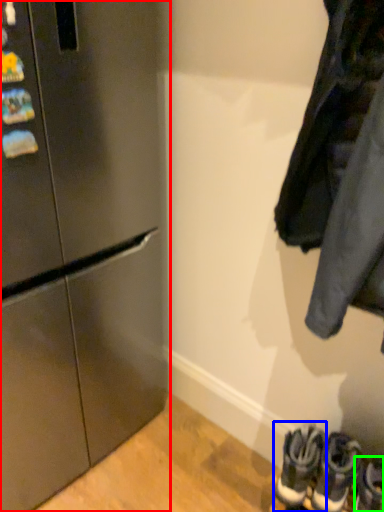
Question: Which object is positioned closest to refrigerator (highlighted by a red box)? Select from footwear (highlighted by a blue box) and footwear (highlighted by a green box).

Choices:
 (A) footwear
 (B) footwear

Answer: (A)